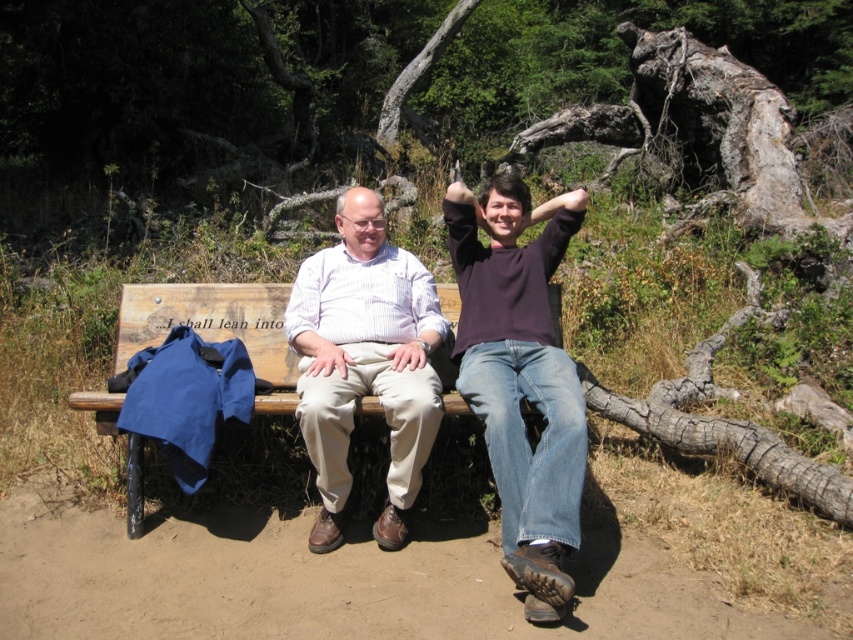
Can you confirm if matte brown shirt at center is thinner than light brown cotton shirt at center?

In fact, matte brown shirt at center might be wider than light brown cotton shirt at center.

Looking at this image, does matte brown shirt at center have a smaller size compared to light brown cotton shirt at center?

Incorrect, matte brown shirt at center is not smaller in size than light brown cotton shirt at center.

Measure the distance between point (505, 369) and camera.

2.85 meters

The image size is (853, 640). Identify the location of matte brown shirt at center. (521, 376).

Is dark purple sweater at upper center bigger than light brown cotton shirt at center?

Indeed, dark purple sweater at upper center has a larger size compared to light brown cotton shirt at center.

Between dark purple sweater at upper center and light brown cotton shirt at center, which one appears on the left side from the viewer's perspective?

From the viewer's perspective, light brown cotton shirt at center appears more on the left side.

Is point (471, 257) closer to viewer compared to point (418, 472)?

No, it is not.

Find the location of a particular element. The width and height of the screenshot is (853, 640). dark purple sweater at upper center is located at coordinates (520, 376).

Does matte brown shirt at center come behind dark purple sweater at upper center?

Yes, it is behind dark purple sweater at upper center.

Between matte brown shirt at center and dark purple sweater at upper center, which one appears on the left side from the viewer's perspective?

From the viewer's perspective, matte brown shirt at center appears more on the left side.

Is point (489, 442) positioned behind point (502, 396)?

No.

Find the location of a particular element. The width and height of the screenshot is (853, 640). matte brown shirt at center is located at coordinates (521, 376).